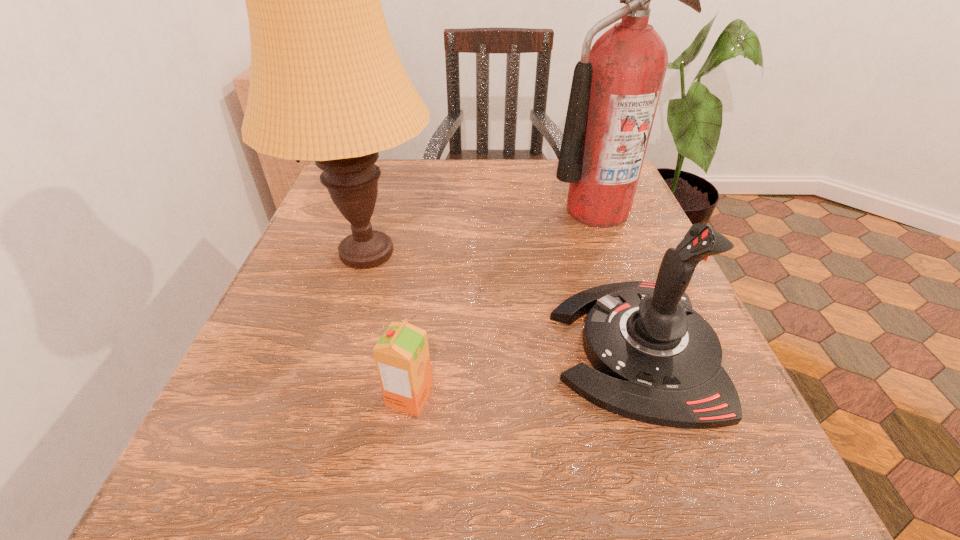
This screenshot has width=960, height=540. What are the coordinates of `vacant space at the near left corner of the desktop` in the screenshot? It's located at (188, 466).

Identify the location of blank region between the fire extinguisher and the shortest object. (503, 304).

The width and height of the screenshot is (960, 540). What are the coordinates of `vacant space in between the fire extinguisher and the lampshade` in the screenshot? It's located at (482, 232).

You are a GUI agent. You are given a task and a screenshot of the screen. Output one action in this format:
    pyautogui.click(x=<x>, y=<y>)
    Task: Click on the empty space that is in between the lampshade and the shortest object
    The width and height of the screenshot is (960, 540).
    Given the screenshot: What is the action you would take?
    pyautogui.click(x=388, y=326)

Locate an element on the screen. The height and width of the screenshot is (540, 960). free spot between the second shortest object and the fire extinguisher is located at coordinates (615, 280).

Where is `empty space that is in between the joystick and the fire extinguisher`? Image resolution: width=960 pixels, height=540 pixels. empty space that is in between the joystick and the fire extinguisher is located at coordinates (615, 280).

This screenshot has height=540, width=960. Identify the location of empty space that is in between the fire extinguisher and the third tallest object. (615, 280).

The height and width of the screenshot is (540, 960). Identify the location of free space between the third tallest object and the shortest object. (522, 373).

The image size is (960, 540). I want to click on free area in between the second shortest object and the fire extinguisher, so click(x=615, y=280).

Image resolution: width=960 pixels, height=540 pixels. I want to click on free space that is in between the lampshade and the joystick, so click(x=501, y=301).